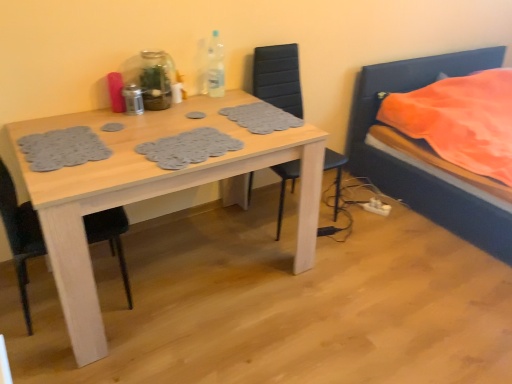
Find the location of a particular element. This screenshot has width=512, height=384. vacant region in front of metallic silver shaker at table center, acting as the 1th bottle starting from the left is located at coordinates (136, 124).